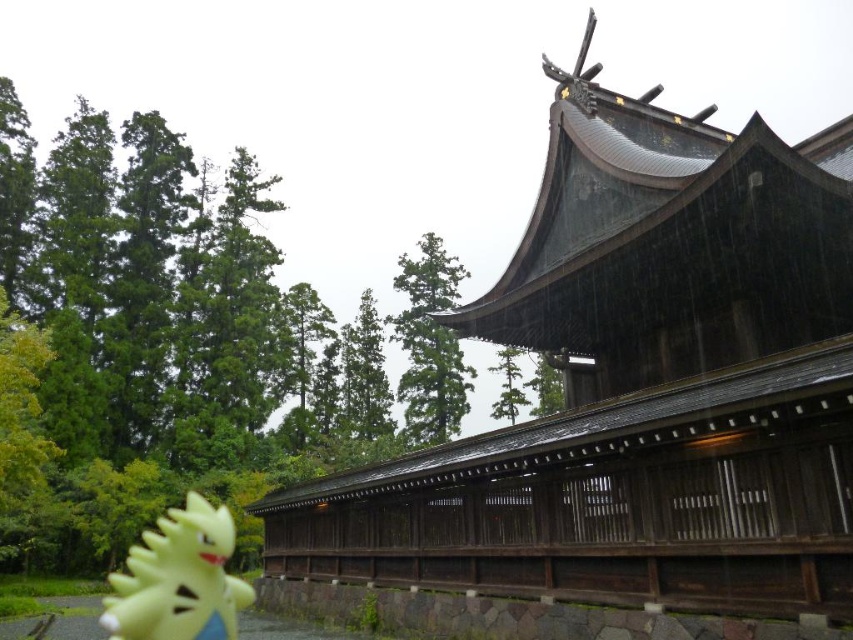
You are a visitor at the temple and want to take a photo of both the shiny dark wood temple at upper center and the yellow rubber toy at lower left. Which object should you focus on first if you want to include both in the frame without moving the camera?

You should focus on the shiny dark wood temple at upper center first because it is larger and positioned at the upper center, making it the main subject. Since it is larger, ensuring it is in focus will naturally include the smaller yellow rubber toy at lower left in the frame as well.